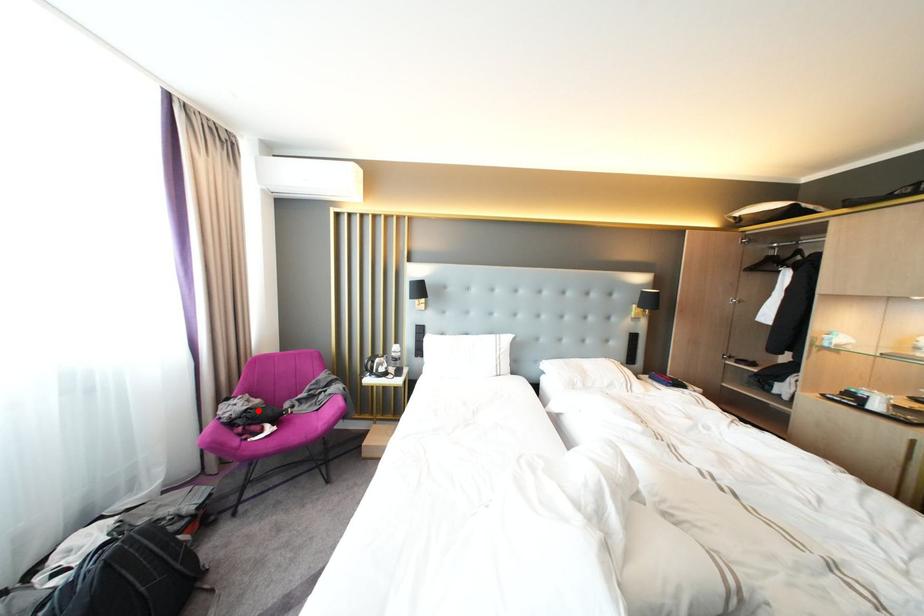
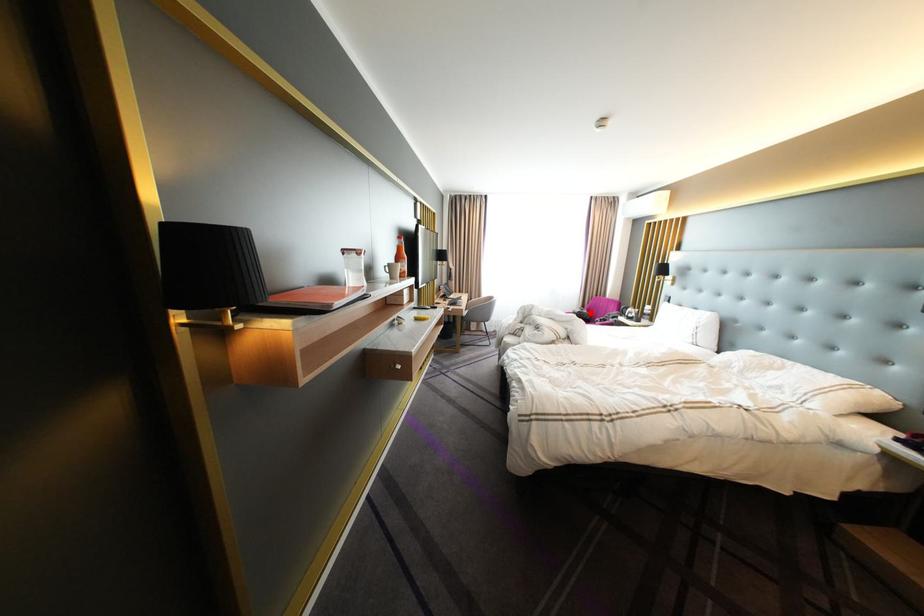
I am providing you with two images of the same scene from different viewpoints. A red point is marked on the first image and another point is marked on the second image. Are the points marked in image1 and image2 representing the same 3D position?

Yes